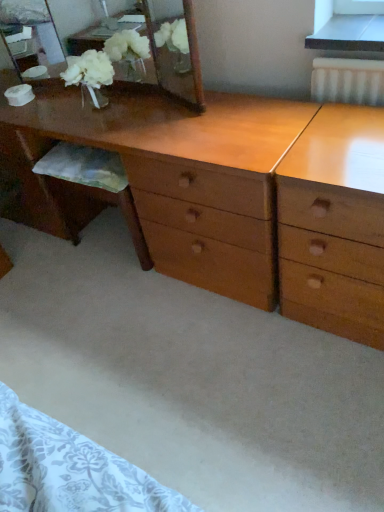
Question: Considering the positions of point (119, 66) and point (347, 219), is point (119, 66) closer or farther from the camera than point (347, 219)?

Choices:
 (A) closer
 (B) farther

Answer: (B)

Question: Visually, is wooden mirror at upper left positioned to the left or to the right of light brown wood desk at center?

Choices:
 (A) left
 (B) right

Answer: (A)

Question: Considering the positions of wooden mirror at upper left and light brown wood desk at center in the image, is wooden mirror at upper left wider or thinner than light brown wood desk at center?

Choices:
 (A) thin
 (B) wide

Answer: (A)

Question: Looking at their shapes, would you say light brown wood desk at center is wider or thinner than wooden mirror at upper left?

Choices:
 (A) thin
 (B) wide

Answer: (B)

Question: Considering the positions of point (319, 161) and point (155, 79), is point (319, 161) closer or farther from the camera than point (155, 79)?

Choices:
 (A) closer
 (B) farther

Answer: (A)

Question: Is light brown wood desk at center in front of or behind wooden mirror at upper left in the image?

Choices:
 (A) front
 (B) behind

Answer: (A)

Question: From the image's perspective, relative to wooden mirror at upper left, is light brown wood desk at center above or below?

Choices:
 (A) above
 (B) below

Answer: (B)